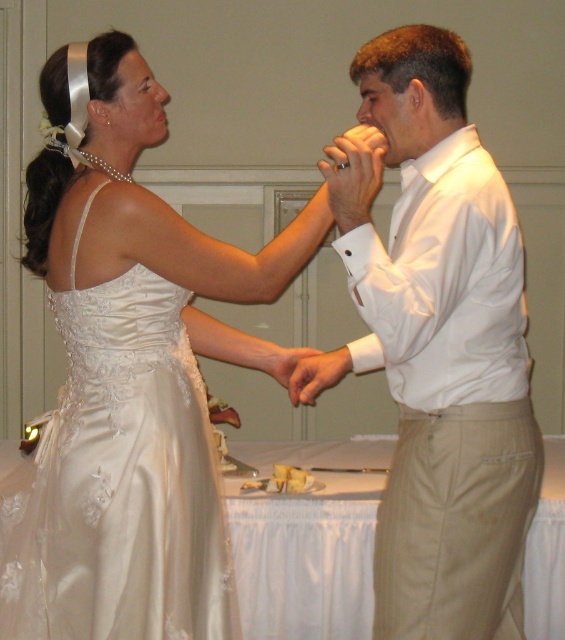
Does satin dress at center appear under white satin shirt at center?

No.

Can you confirm if satin dress at center is thinner than white satin shirt at center?

No, satin dress at center is not thinner than white satin shirt at center.

Is point (202, 618) closer to viewer compared to point (364, 262)?

No, it is behind (364, 262).

Identify the location of satin dress at center. (131, 371).

Which is behind, point (159, 259) or point (195, 404)?

Positioned behind is point (195, 404).

Which is below, satin dress at center or satin/embroidered dress at left?

satin/embroidered dress at left is lower down.

Does point (151, 492) come in front of point (188, 573)?

Yes, point (151, 492) is in front of point (188, 573).

Identify the location of satin dress at center. The height and width of the screenshot is (640, 565). (131, 371).

Can you confirm if satin/embroidered dress at left is positioned to the right of matte white hand at upper center?

Incorrect, satin/embroidered dress at left is not on the right side of matte white hand at upper center.

Who is lower down, satin/embroidered dress at left or matte white hand at upper center?

satin/embroidered dress at left is below.

Locate an element on the screen. The image size is (565, 640). satin/embroidered dress at left is located at coordinates (120, 481).

Find the location of `satin/embroidered dress at left`. satin/embroidered dress at left is located at coordinates (120, 481).